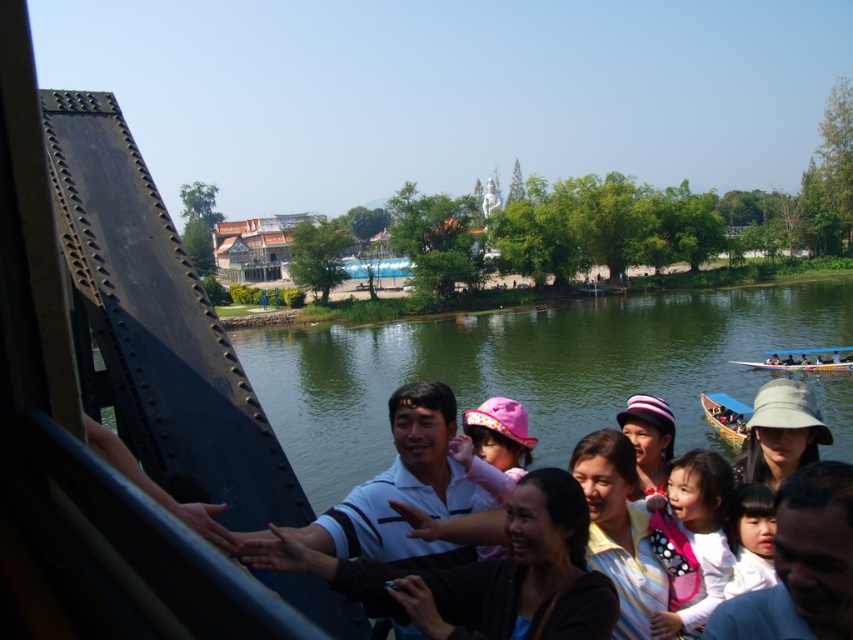
Question: Which is farther from the smooth white shirt at center?

Choices:
 (A) striped shirt at center
 (B) wooden boat at lower right
 (C) light pink fabric at center

Answer: (B)

Question: From the image, what is the correct spatial relationship of light pink fabric at center in relation to wooden boat at lower right?

Choices:
 (A) left
 (B) right

Answer: (A)

Question: Which point is farther from the camera taking this photo?

Choices:
 (A) (624, 541)
 (B) (762, 557)
 (C) (788, 364)

Answer: (C)

Question: Observing the image, what is the correct spatial positioning of smooth white shirt at center in reference to striped fabric hat at center?

Choices:
 (A) right
 (B) left

Answer: (A)

Question: Which point is closer to the camera taking this photo?

Choices:
 (A) (595, 496)
 (B) (746, 460)
 (C) (485, 627)
 (D) (695, 474)

Answer: (C)

Question: Can you confirm if striped shirt at center is smaller than white fabric hat at center?

Choices:
 (A) no
 (B) yes

Answer: (A)